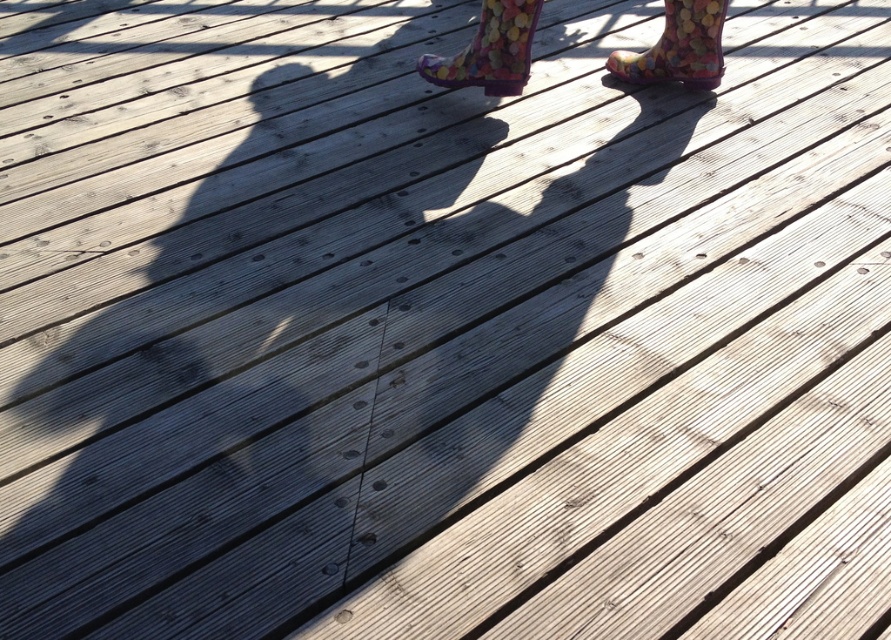
Question: Among these points, which one is farthest from the camera?

Choices:
 (A) (668, 8)
 (B) (481, 19)
 (C) (435, 60)

Answer: (C)

Question: Does multicolored rubber boots at center have a lesser width compared to multicolored rubber boot at upper right?

Choices:
 (A) yes
 (B) no

Answer: (B)

Question: Estimate the real-world distances between objects in this image. Which object is farther from the multicolored rubber boot at upper right?

Choices:
 (A) floral rubber boot at upper center
 (B) multicolored rubber boots at center

Answer: (A)

Question: Does multicolored rubber boots at center have a greater width compared to multicolored rubber boot at upper right?

Choices:
 (A) no
 (B) yes

Answer: (B)

Question: Does multicolored rubber boots at center have a smaller size compared to multicolored rubber boot at upper right?

Choices:
 (A) no
 (B) yes

Answer: (A)

Question: Which object is farther from the camera taking this photo?

Choices:
 (A) floral rubber boot at upper center
 (B) multicolored rubber boot at upper right
 (C) multicolored rubber boots at center

Answer: (B)